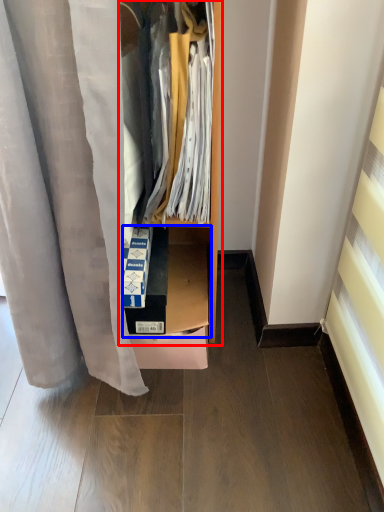
Question: Which object is closer to the camera taking this photo, dresser (highlighted by a red box) or shelf (highlighted by a blue box)?

Choices:
 (A) dresser
 (B) shelf

Answer: (A)